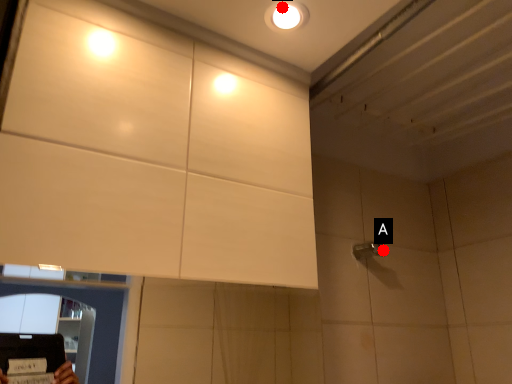
Question: Two points are circled on the image, labeled by A and B beside each circle. Which point is closer to the camera?

Choices:
 (A) A is closer
 (B) B is closer

Answer: (B)